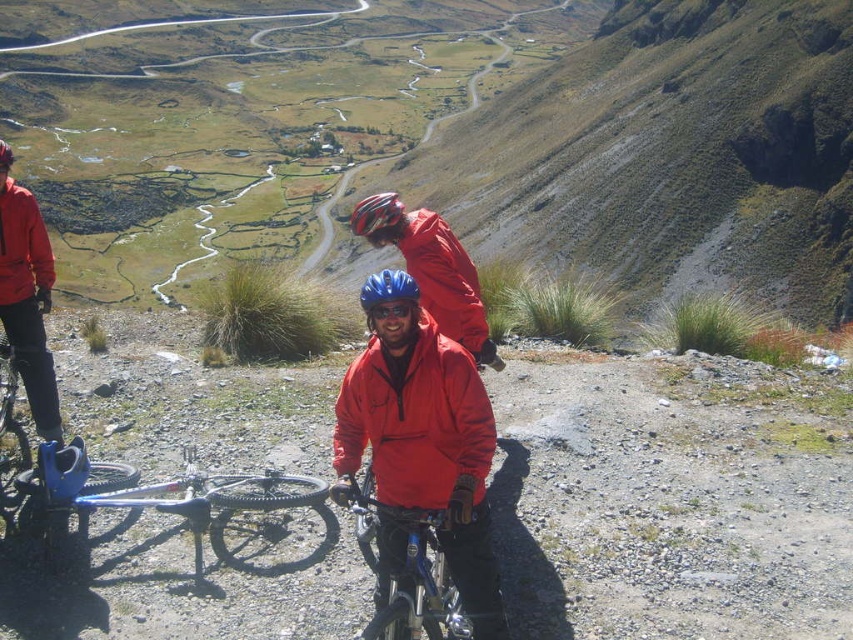
Does point (215, 506) lie in front of point (412, 307)?

That is False.

Is blue metallic bicycle at lower left behind blue reflective goggles at center?

Yes, blue metallic bicycle at lower left is behind blue reflective goggles at center.

The image size is (853, 640). Describe the element at coordinates (152, 490) in the screenshot. I see `blue metallic bicycle at lower left` at that location.

Where is `blue metallic bicycle at lower left`? blue metallic bicycle at lower left is located at coordinates (152, 490).

This screenshot has height=640, width=853. In order to click on matte red jacket at center in this screenshot , I will do `click(415, 419)`.

Does blue matte bicycle helmet at center have a smaller size compared to blue reflective goggles at center?

No.

Identify the location of blue matte bicycle helmet at center. (387, 289).

Which is in front, point (395, 273) or point (372, 307)?

Point (372, 307)

Image resolution: width=853 pixels, height=640 pixels. Identify the location of blue matte bicycle helmet at center. (387, 289).